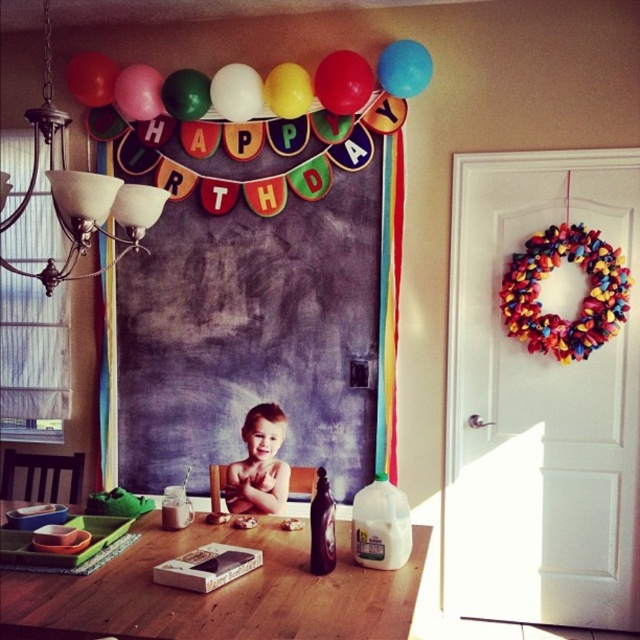
You are a photographer setting up for a birthday photo shoot. You need to ensure that all balloons are visible in the frame. Given that the blue matte balloon at upper center and the pink matte balloon at upper center are both in the scene, which balloon might be partially obscured if the camera is positioned to focus on the child?

The blue matte balloon at upper center is shorter than the pink matte balloon at upper center, so it might be partially obscured by the pink balloon if the camera focuses on the child.

You are planning to decorate a party area and need to know how much space each balloon takes up. Given the blue matte balloon at upper center and the pink matte balloon at upper center, which one requires more space in the decoration setup?

The pink matte balloon at upper center requires more space because it occupies more space than the blue matte balloon at upper center.